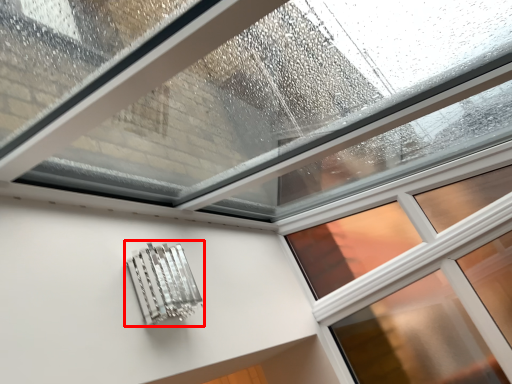
Question: From the image's perspective, where is metal (annotated by the red box) located relative to window?

Choices:
 (A) below
 (B) above

Answer: (A)